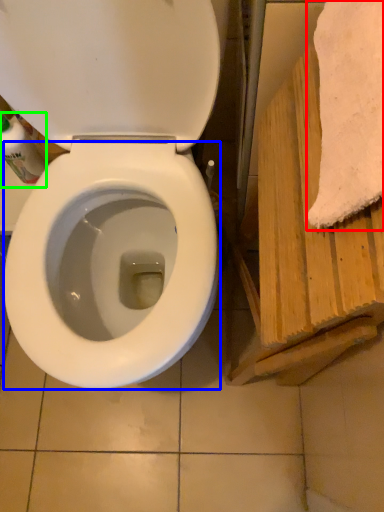
Question: Considering the real-world distances, which object is closest to bath towel (highlighted by a red box)? bidet (highlighted by a blue box) or cleaning product (highlighted by a green box).

Choices:
 (A) bidet
 (B) cleaning product

Answer: (A)